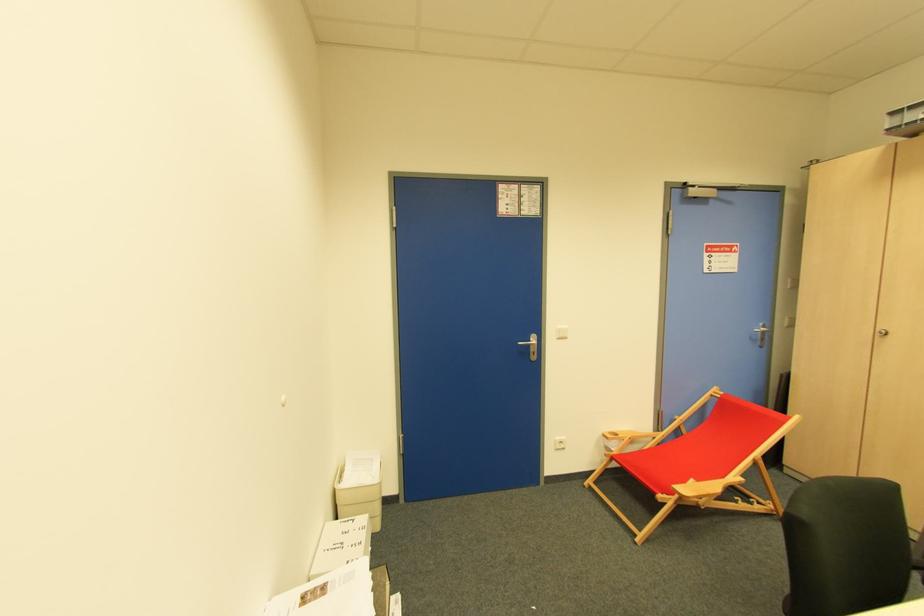
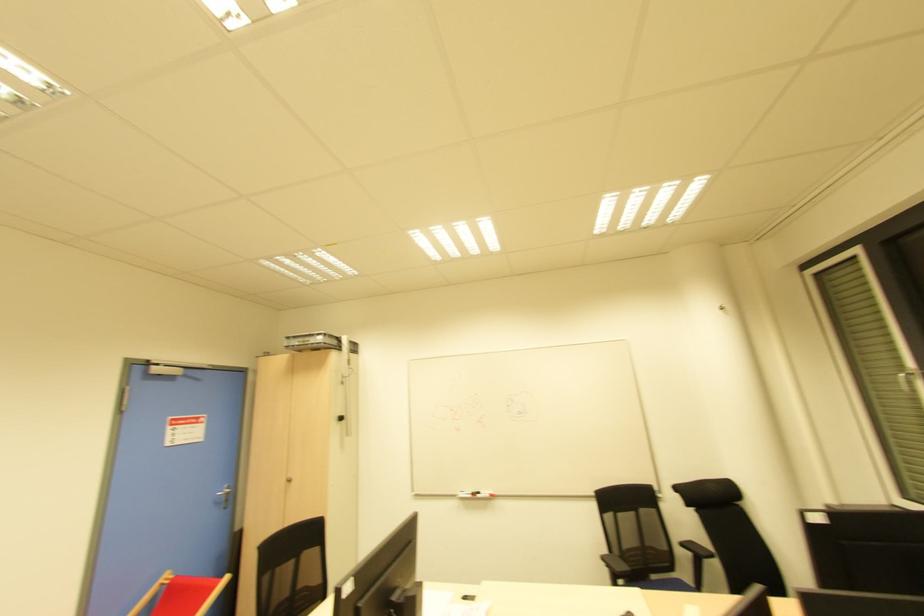
Locate, in the second image, the point that corresponds to (x=888, y=131) in the first image.

(286, 347)